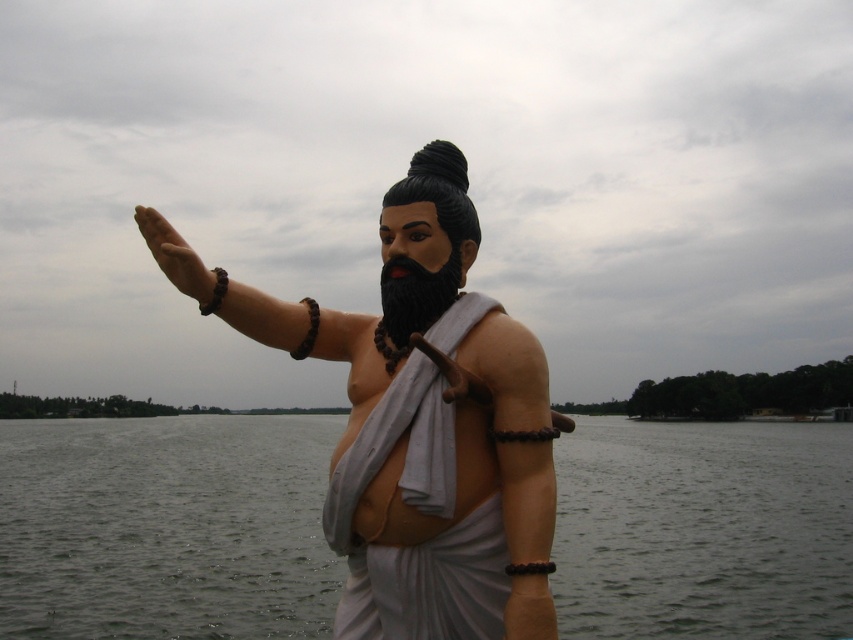
You are an artist planning to sketch this statue and its surroundings. You want to ensure the proportions are accurate. Which object, the transparent water at statue right or the black matte beard at center, should you focus on drawing first because it takes up more space in the image?

The transparent water at statue right is larger in size than the black matte beard at center, so you should focus on drawing the transparent water at statue right first as it occupies more space in the image.

You are an artist trying to create a miniature version of the statue. You have a limited amount of white clay for the statue and black clay for the beard. Given that the matte white statue at center is wider than the black matte beard at center, which part will require more clay?

The matte white statue at center requires more clay because it is wider than the black matte beard at center.

You are a tourist standing in front of the statue. You want to take a photo that includes both the transparent water at statue right and the black matte beard at center. Which object should you focus on first to ensure both are in focus?

You should focus on the black matte beard at center first because it is farther away from the viewer than the transparent water at statue right, ensuring both are within the depth of field.